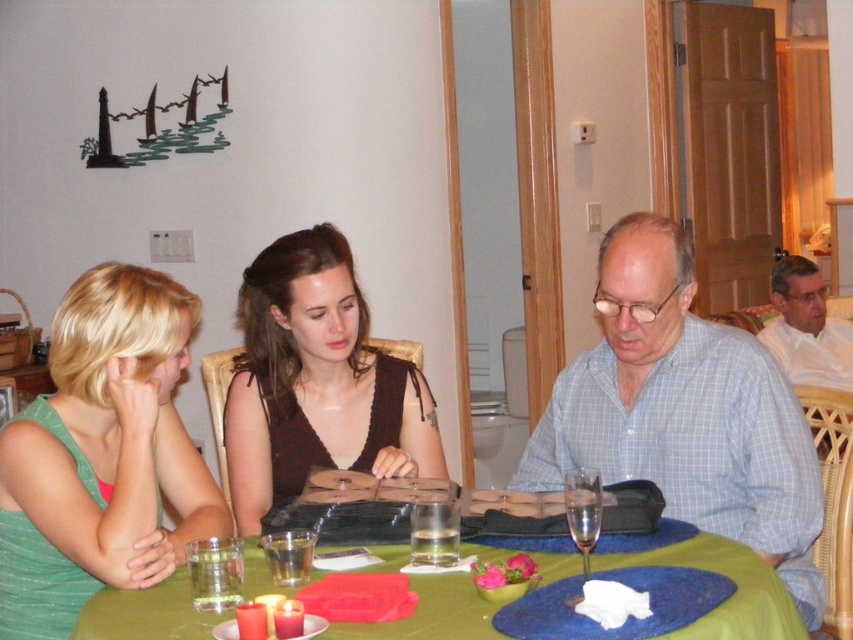
Does matte black laptop at center have a smaller size compared to clear glass wine glass at center?

Incorrect, matte black laptop at center is not smaller in size than clear glass wine glass at center.

Who is lower down, matte black laptop at center or clear glass wine glass at center?

Positioned lower is clear glass wine glass at center.

Image resolution: width=853 pixels, height=640 pixels. What do you see at coordinates (685, 412) in the screenshot?
I see `matte black laptop at center` at bounding box center [685, 412].

At what (x,y) coordinates should I click in order to perform the action: click on matte black laptop at center. Please return your answer as a coordinate pair (x, y). Looking at the image, I should click on (685, 412).

Is point (113, 620) behind point (796, 294)?

No, (113, 620) is closer to viewer.

Does green fabric table at center come in front of white shirt at right?

That is True.

Locate an element on the screen. The height and width of the screenshot is (640, 853). green fabric table at center is located at coordinates [730, 596].

Can you confirm if matte brown dress at center is positioned below clear glass wine glass at center?

Incorrect, matte brown dress at center is not positioned below clear glass wine glass at center.

Describe the element at coordinates (316, 381) in the screenshot. This screenshot has width=853, height=640. I see `matte brown dress at center` at that location.

Is point (322, 392) positioned in front of point (567, 477)?

No, it is not.

Where is `matte brown dress at center`? Image resolution: width=853 pixels, height=640 pixels. matte brown dress at center is located at coordinates (316, 381).